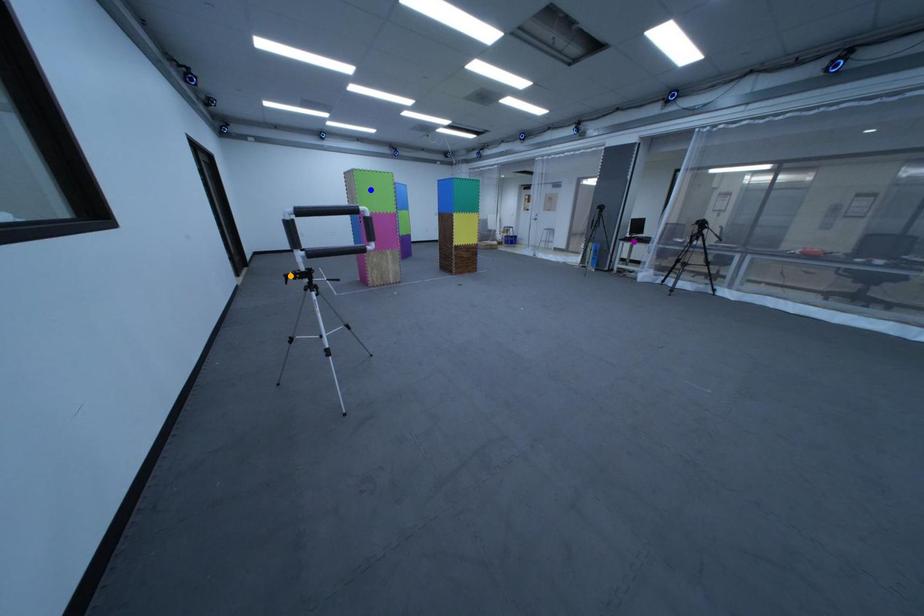
Order these from nearest to farthest:
orange point | purple point | blue point

orange point → blue point → purple point